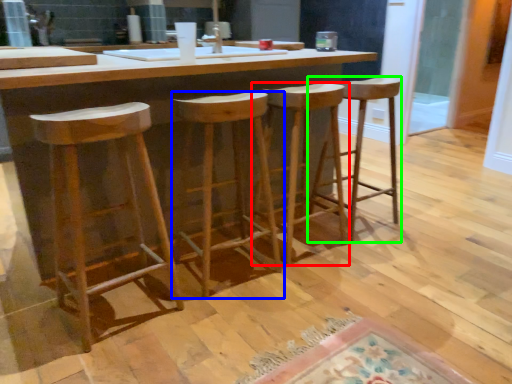
Question: Which object is positioned farthest from stool (highlighted by a red box)? Select from stool (highlighted by a blue box) and stool (highlighted by a green box).

Choices:
 (A) stool
 (B) stool

Answer: (A)